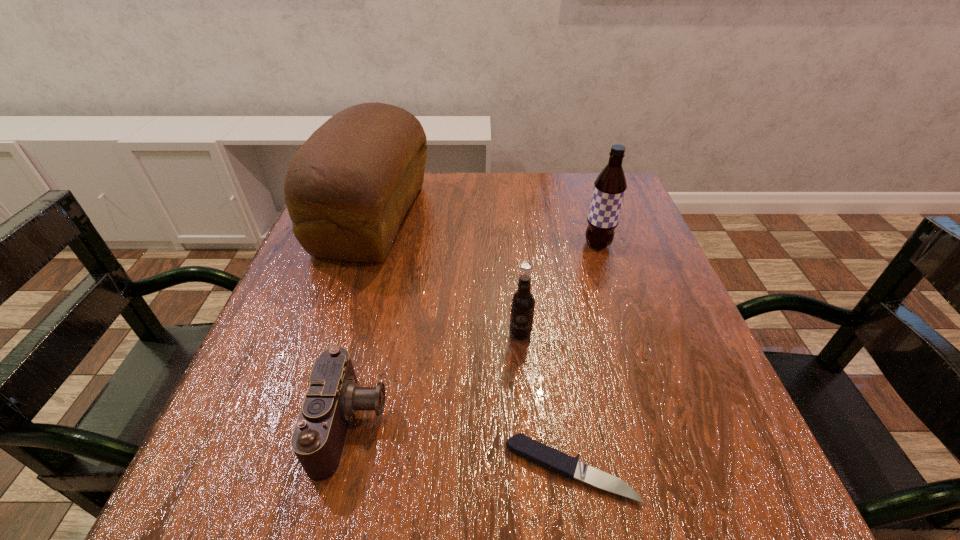
The height and width of the screenshot is (540, 960). Find the location of `free spot located on the front-facing side of the second shortest object`. free spot located on the front-facing side of the second shortest object is located at coordinates (495, 423).

I want to click on free spot located 0.090m on the left of the shortest object, so click(x=444, y=470).

Where is `object located at the far edge`? Image resolution: width=960 pixels, height=540 pixels. object located at the far edge is located at coordinates (347, 189).

Identify the location of camera that is at the near edge. Image resolution: width=960 pixels, height=540 pixels. (333, 396).

Locate an element on the screen. This screenshot has width=960, height=540. steak knife situated at the near edge is located at coordinates (534, 451).

Identify the location of bread at the left edge. The width and height of the screenshot is (960, 540). (347, 189).

I want to click on camera that is positioned at the left edge, so coord(333,396).

Where is `object that is at the right edge`? The height and width of the screenshot is (540, 960). object that is at the right edge is located at coordinates (609, 187).

I want to click on object that is at the far left corner, so click(347, 189).

Image resolution: width=960 pixels, height=540 pixels. I want to click on object at the near left corner, so click(333, 396).